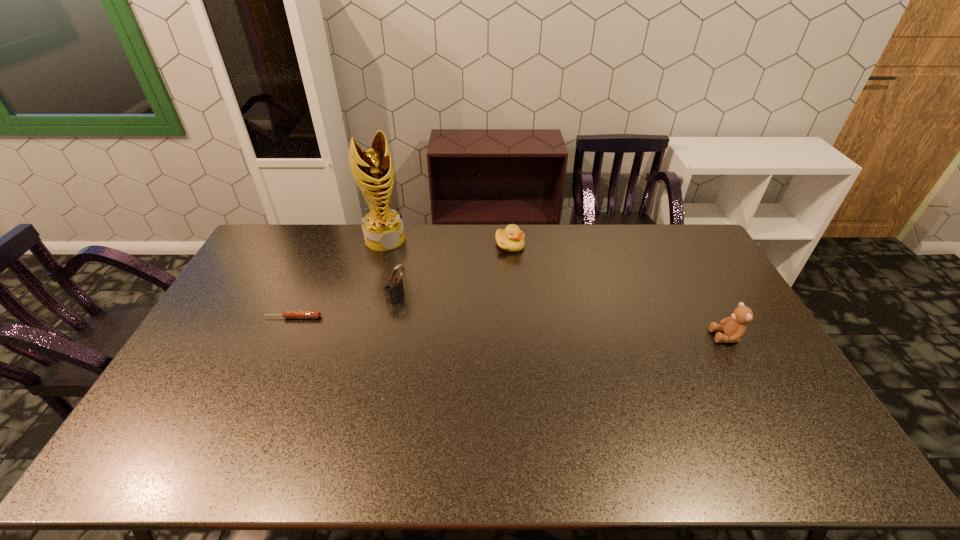
Find the location of a particular element. The image size is (960, 540). free space located on the front-facing side of the tallest object is located at coordinates (423, 295).

At what (x,y) coordinates should I click in order to perform the action: click on duckling at the far edge. Please return your answer as a coordinate pair (x, y). Looking at the image, I should click on (511, 239).

The height and width of the screenshot is (540, 960). In order to click on award that is positioned at the far edge in this screenshot , I will do `click(383, 229)`.

Locate an element on the screen. Image resolution: width=960 pixels, height=540 pixels. object at the right edge is located at coordinates (734, 327).

In order to click on vacant space at the far edge in this screenshot , I will do `click(528, 235)`.

Where is `free location at the near edge of the desktop`? The image size is (960, 540). free location at the near edge of the desktop is located at coordinates (527, 425).

This screenshot has height=540, width=960. In order to click on vacant point at the right edge in this screenshot , I will do `click(708, 268)`.

Where is `free location at the far left corner of the desktop`? free location at the far left corner of the desktop is located at coordinates (252, 261).

Find the location of a particular element. free space at the near right corner of the desktop is located at coordinates (808, 420).

You are a GUI agent. You are given a task and a screenshot of the screen. Output one action in this format:
    pyautogui.click(x=<x>, y=<y>)
    Task: Click on the vacant region between the award and the third farthest object
    
    Given the screenshot: What is the action you would take?
    pyautogui.click(x=391, y=267)